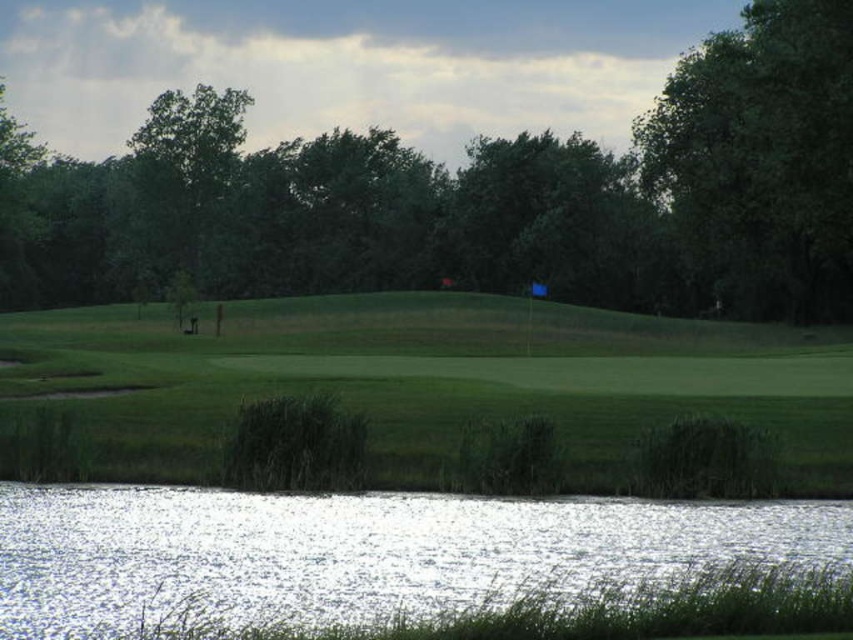
Question: Which of these objects is positioned farthest from the green leafy tree at upper right?

Choices:
 (A) green leafy tree at center
 (B) clear water at lower left
 (C) green grassy hill at center

Answer: (B)

Question: Can you confirm if green grassy hill at center is bigger than clear water at lower left?

Choices:
 (A) no
 (B) yes

Answer: (B)

Question: Does green leafy tree at center have a smaller size compared to clear water at lower left?

Choices:
 (A) no
 (B) yes

Answer: (A)

Question: Is green leafy tree at center bigger than green grassy hill at center?

Choices:
 (A) yes
 (B) no

Answer: (A)

Question: Which object appears farthest from the camera in this image?

Choices:
 (A) clear water at lower left
 (B) green grassy hill at center

Answer: (B)

Question: Estimate the real-world distances between objects in this image. Which object is farther from the clear water at lower left?

Choices:
 (A) green grassy hill at center
 (B) green leafy tree at center
 (C) green leafy tree at upper right

Answer: (B)